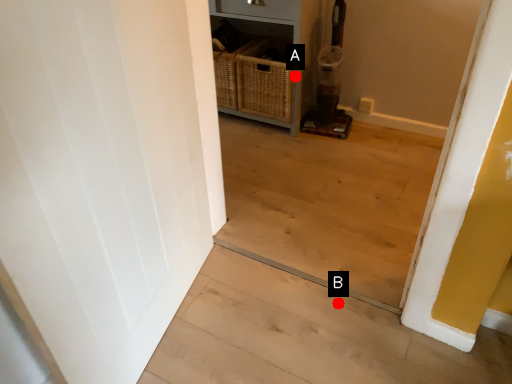
Question: Two points are circled on the image, labeled by A and B beside each circle. Among these points, which one is nearest to the camera?

Choices:
 (A) A is closer
 (B) B is closer

Answer: (B)